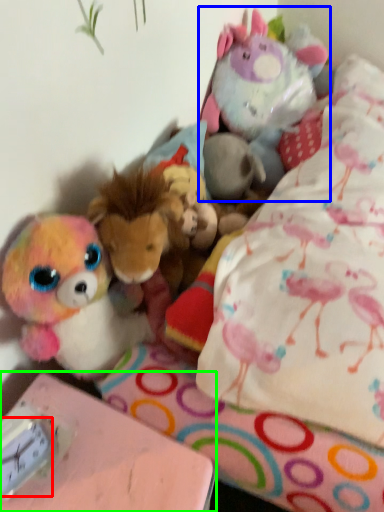
Question: Estimate the real-world distances between objects in this image. Which object is closer to clock (highlighted by a red box), toy (highlighted by a blue box) or table (highlighted by a green box)?

Choices:
 (A) toy
 (B) table

Answer: (B)